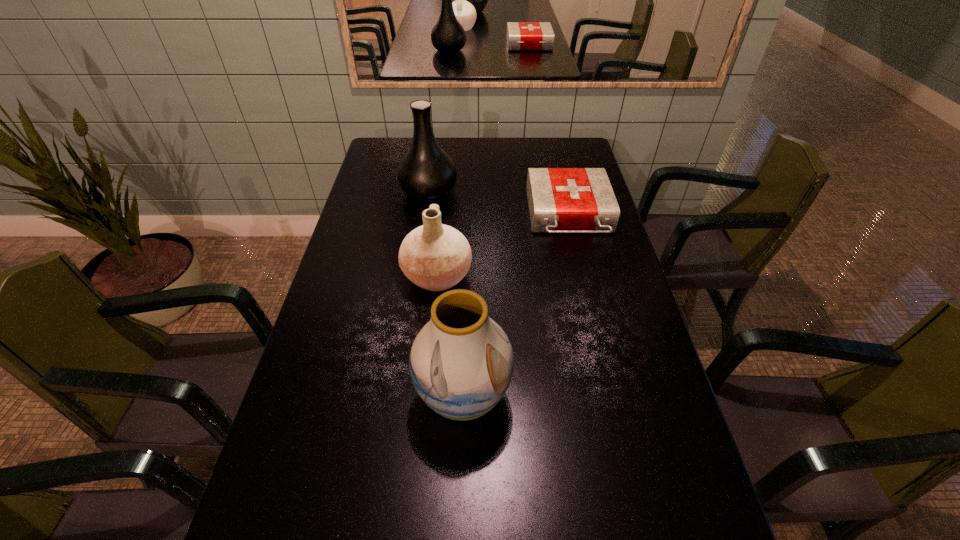
This screenshot has width=960, height=540. I want to click on object at the left edge, so click(x=426, y=172).

I want to click on object at the right edge, so click(561, 200).

Locate an element on the screen. vacant space at the far edge is located at coordinates (493, 156).

The width and height of the screenshot is (960, 540). Identify the location of free space at the left edge of the desktop. (348, 352).

Locate an element on the screen. Image resolution: width=960 pixels, height=540 pixels. vacant position at the right edge of the desktop is located at coordinates (607, 325).

The image size is (960, 540). I want to click on free space between the rightmost object and the third farthest object, so click(503, 246).

Where is `vacant space in between the rightmost object and the farther vase`? The width and height of the screenshot is (960, 540). vacant space in between the rightmost object and the farther vase is located at coordinates (499, 204).

Find the location of a particular element. The height and width of the screenshot is (540, 960). vacant area that lies between the pottery and the first-aid kit is located at coordinates (503, 246).

Locate an element on the screen. This screenshot has width=960, height=540. vacant point located between the nearer vase and the rightmost object is located at coordinates (516, 306).

Locate an element on the screen. Image resolution: width=960 pixels, height=540 pixels. unoccupied position between the first-aid kit and the second shortest object is located at coordinates (503, 246).